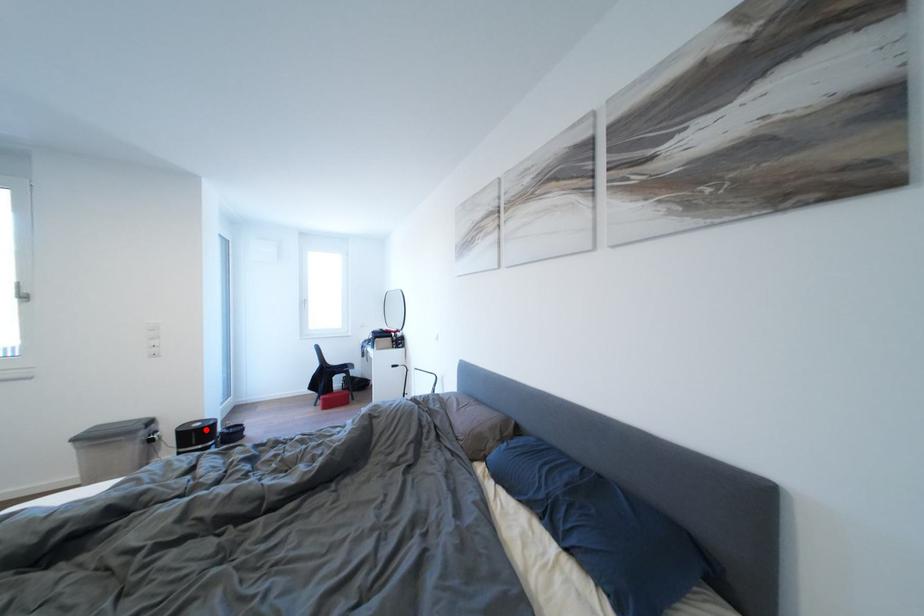
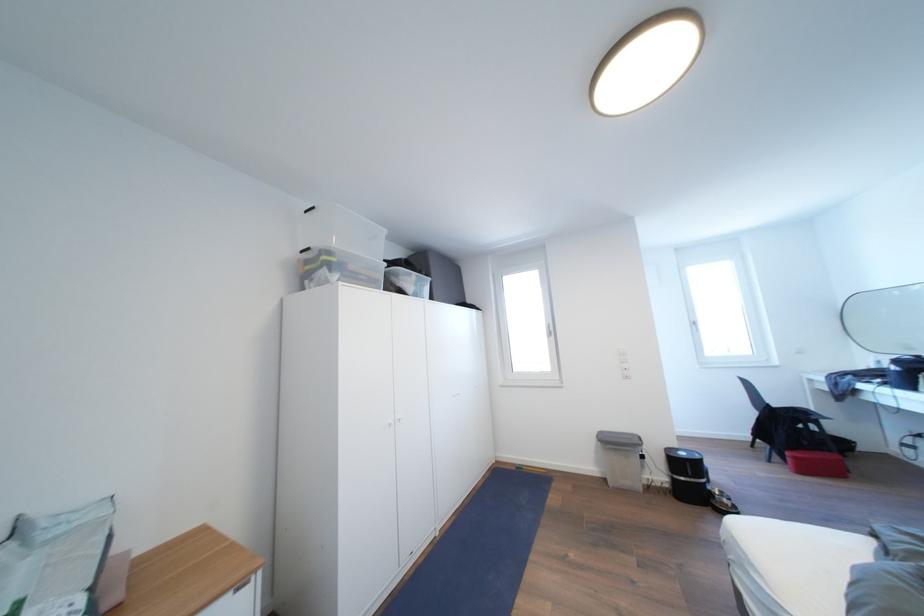
In the second image, find the point that corresponds to the highlighted location in the first image.

(689, 459)